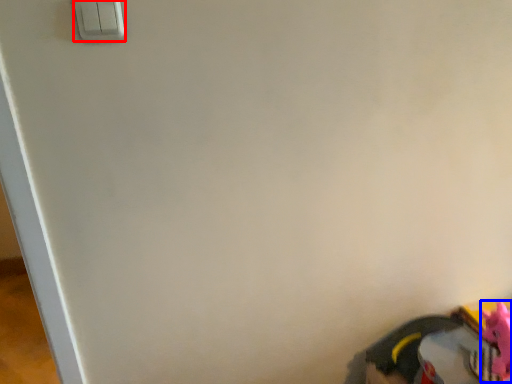
Question: Which object appears closest to the camera in this image, light switch (highlighted by a red box) or toy (highlighted by a blue box)?

Choices:
 (A) light switch
 (B) toy

Answer: (A)